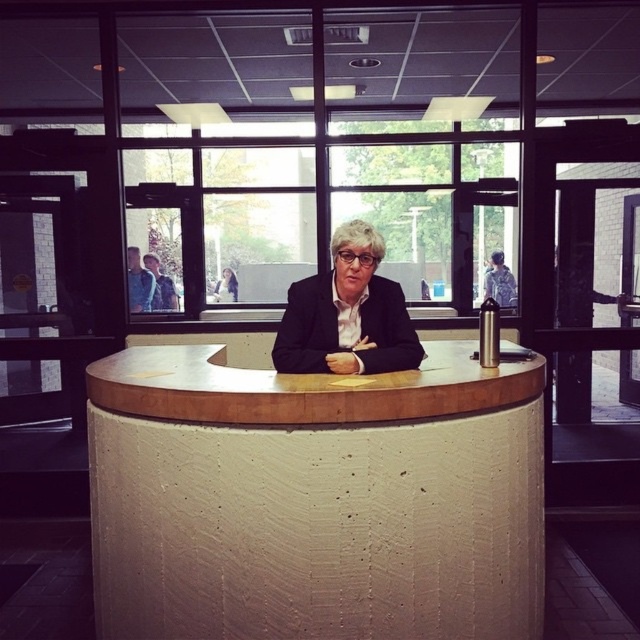
Question: Which point is closer to the camera?

Choices:
 (A) black matte blazer at center
 (B) white textured table at center

Answer: (B)

Question: Is white textured table at center behind black matte blazer at center?

Choices:
 (A) no
 (B) yes

Answer: (A)

Question: Which point appears closest to the camera in this image?

Choices:
 (A) (336, 234)
 (B) (307, 490)

Answer: (B)

Question: Is white textured table at center further to camera compared to black matte blazer at center?

Choices:
 (A) yes
 (B) no

Answer: (B)

Question: Is white textured table at center below black matte blazer at center?

Choices:
 (A) no
 (B) yes

Answer: (B)

Question: Which point is closer to the camera taking this photo?

Choices:
 (A) (381, 296)
 (B) (525, 564)

Answer: (B)